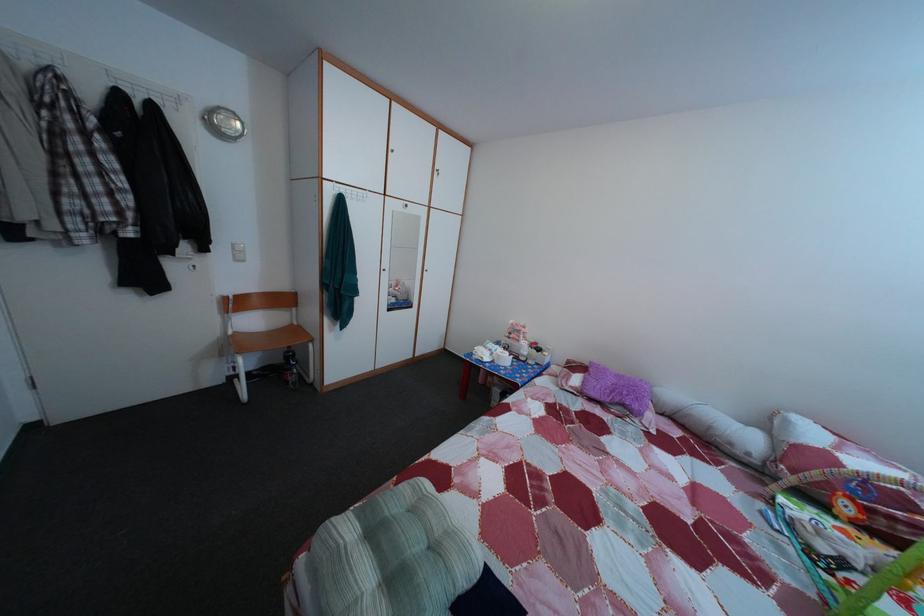
The location [619,392] corresponds to which object?

It refers to a purple fuzzy pillow.